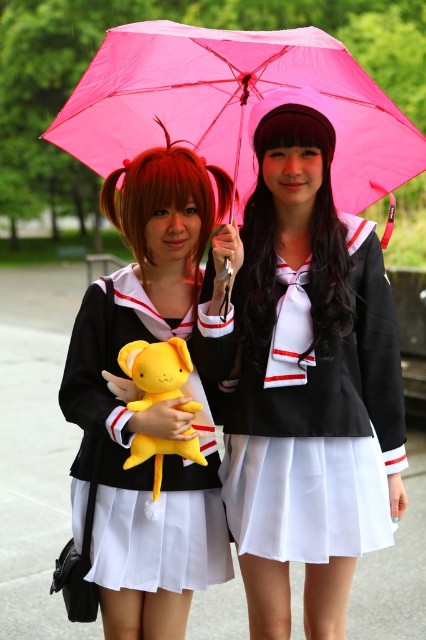
Question: Considering the relative positions of matte black dress at center and pink fabric umbrella at upper center in the image provided, where is matte black dress at center located with respect to pink fabric umbrella at upper center?

Choices:
 (A) left
 (B) right

Answer: (A)

Question: Among these objects, which one is nearest to the camera?

Choices:
 (A) pink fabric umbrella at upper center
 (B) matte black dress at center

Answer: (A)

Question: Which object appears closest to the camera in this image?

Choices:
 (A) matte black dress at center
 (B) yellow plush toy at center

Answer: (B)

Question: Can you confirm if matte black dress at center is wider than pink fabric umbrella at upper center?

Choices:
 (A) no
 (B) yes

Answer: (A)

Question: Which is nearer to the yellow plush toy at center?

Choices:
 (A) matte black dress at center
 (B) satin black uniform at center
 (C) pink fabric umbrella at upper center

Answer: (A)

Question: Is satin black uniform at center bigger than matte black dress at center?

Choices:
 (A) no
 (B) yes

Answer: (A)